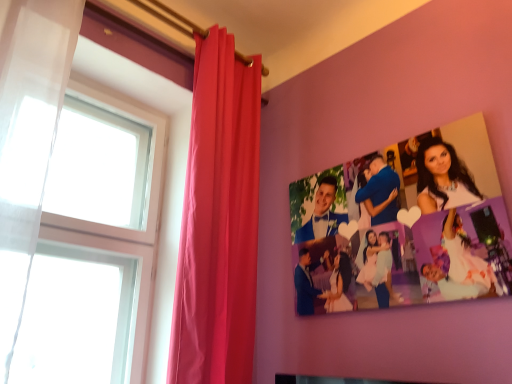
The width and height of the screenshot is (512, 384). Describe the element at coordinates (218, 222) in the screenshot. I see `matte pink curtain at left` at that location.

The height and width of the screenshot is (384, 512). What are the coordinates of `matte pink curtain at left` in the screenshot? It's located at (218, 222).

Identify the location of matte pink curtain at left. The image size is (512, 384). (218, 222).